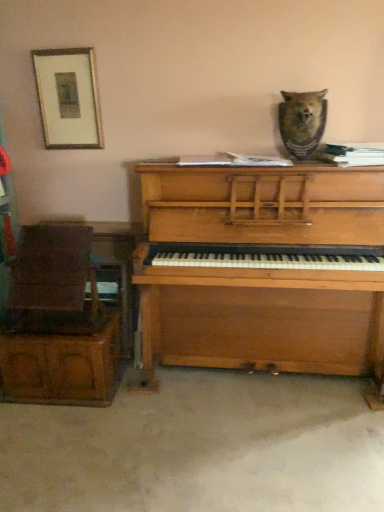
The height and width of the screenshot is (512, 384). Identify the location of wooden picture frame at upper left. (68, 98).

Image resolution: width=384 pixels, height=512 pixels. I want to click on wooden piano at center, so click(x=262, y=270).

The width and height of the screenshot is (384, 512). What do you see at coordinates (302, 122) in the screenshot? I see `brown fur bear at upper center` at bounding box center [302, 122].

This screenshot has height=512, width=384. Describe the element at coordinates (57, 323) in the screenshot. I see `wooden chair at left` at that location.

The height and width of the screenshot is (512, 384). What are the coordinates of `wooden picture frame at upper left` in the screenshot? It's located at (68, 98).

Image resolution: width=384 pixels, height=512 pixels. In the image, there is a wooden piano at center. In order to click on furniture below it (from the image's perspective) in this screenshot , I will do `click(57, 323)`.

Considering the relative positions of wooden chair at left and wooden piano at center in the image provided, is wooden chair at left behind wooden piano at center?

That is True.

Is wooden chair at left completely or partially outside of wooden piano at center?

wooden chair at left is positioned outside wooden piano at center.

Is wooden chair at left positioned with its back to wooden piano at center?

No, wooden chair at left is not facing away from wooden piano at center.

Who is bigger, wooden piano at center or wooden chair at left?

Bigger between the two is wooden piano at center.

Is wooden piano at center directly adjacent to wooden chair at left?

There is a gap between wooden piano at center and wooden chair at left.

From the image's perspective, would you say wooden piano at center is positioned over wooden chair at left?

Yes, from the image's perspective, wooden piano at center is on top of wooden chair at left.

Is wooden piano at center further to camera compared to wooden chair at left?

No, wooden piano at center is closer to the viewer.

Between point (41, 80) and point (309, 95), which one is positioned behind?

Point (41, 80)

Which is behind, wooden picture frame at upper left or brown fur bear at upper center?

wooden picture frame at upper left is more distant.

From the image's perspective, which one is positioned higher, wooden picture frame at upper left or brown fur bear at upper center?

wooden picture frame at upper left, from the image's perspective.

Could you tell me if wooden picture frame at upper left is turned towards brown fur bear at upper center?

No, wooden picture frame at upper left is not facing towards brown fur bear at upper center.

Is wooden chair at left smaller than wooden piano at center?

Yes.

Considering the relative sizes of wooden chair at left and wooden piano at center in the image provided, is wooden chair at left shorter than wooden piano at center?

Indeed, wooden chair at left has a lesser height compared to wooden piano at center.

Is wooden chair at left aimed at wooden piano at center?

No, wooden chair at left is not facing towards wooden piano at center.

From a real-world perspective, is wooden piano at center physically located above or below brown fur bear at upper center?

wooden piano at center is below brown fur bear at upper center.

In terms of width, does wooden piano at center look wider or thinner when compared to brown fur bear at upper center?

wooden piano at center is wider than brown fur bear at upper center.

Is wooden piano at center with brown fur bear at upper center?

wooden piano at center and brown fur bear at upper center are not in contact.

Is brown fur bear at upper center at the back of wooden piano at center?

No, wooden piano at center is not facing away from brown fur bear at upper center.

Would you say wooden chair at left is a long distance from wooden chair at left?

No.

Between point (97, 307) and point (115, 261), which one is positioned behind?

The point (115, 261) is behind.

From a real-world perspective, between wooden chair at left and wooden chair at left, who is vertically lower?

wooden chair at left is physically lower.

From the picture: Considering the sizes of objects wooden chair at left and wooden chair at left in the image provided, who is smaller, wooden chair at left or wooden chair at left?

wooden chair at left is smaller.

In terms of size, does brown fur bear at upper center appear bigger or smaller than wooden chair at left?

Considering their sizes, brown fur bear at upper center takes up less space than wooden chair at left.

Image resolution: width=384 pixels, height=512 pixels. In order to click on animal located above the wooden chair at left (from a real-world perspective) in this screenshot , I will do click(x=302, y=122).

Would you consider brown fur bear at upper center to be distant from wooden chair at left?

Yes, brown fur bear at upper center and wooden chair at left are quite far apart.

What's the angular difference between brown fur bear at upper center and wooden chair at left's facing directions?

The facing directions of brown fur bear at upper center and wooden chair at left are 4.94 degrees apart.

Locate an element on the screen. Image resolution: width=384 pixels, height=512 pixels. furniture above the wooden piano at center (from a real-world perspective) is located at coordinates (57, 323).

This screenshot has width=384, height=512. Identify the location of piano above the wooden chair at left (from the image's perspective). click(262, 270).

When comparing their distances from wooden piano at center, does wooden picture frame at upper left or brown fur bear at upper center seem closer?

brown fur bear at upper center is closer to wooden piano at center.

From the image, which object appears to be nearer to brown fur bear at upper center, wooden chair at left or wooden piano at center?

wooden piano at center is positioned closer to the anchor brown fur bear at upper center.

When comparing their distances from wooden chair at left, does wooden piano at center or brown fur bear at upper center seem closer?

Among the two, wooden piano at center is located nearer to wooden chair at left.

When comparing their distances from wooden chair at left, does wooden piano at center or brown fur bear at upper center seem closer?

Based on the image, wooden piano at center appears to be nearer to wooden chair at left.

Looking at the image, which one is located further to wooden piano at center, wooden chair at left or brown fur bear at upper center?

Based on the image, wooden chair at left appears to be further to wooden piano at center.

Considering their positions, is wooden piano at center positioned closer to wooden chair at left than wooden chair at left?

wooden chair at left is positioned closer to the anchor wooden chair at left.

Considering their positions, is brown fur bear at upper center positioned further to wooden picture frame at upper left than wooden piano at center?

Among the two, brown fur bear at upper center is located further to wooden picture frame at upper left.

Looking at the image, which one is located closer to wooden picture frame at upper left, wooden chair at left or brown fur bear at upper center?

The object closer to wooden picture frame at upper left is wooden chair at left.

At what (x,y) coordinates should I click in order to perform the action: click on table between wooden chair at left and wooden piano at center. Please return your answer as a coordinate pair (x, y). Looking at the image, I should click on (115, 268).

Locate an element on the screen. This screenshot has width=384, height=512. furniture between wooden picture frame at upper left and wooden chair at left from top to bottom is located at coordinates (57, 323).

You are a GUI agent. You are given a task and a screenshot of the screen. Output one action in this format:
    pyautogui.click(x=<x>, y=<y>)
    Task: Click on the table between wooden picture frame at upper left and brown fur bear at upper center in the horizontal direction
    This screenshot has height=512, width=384.
    Given the screenshot: What is the action you would take?
    pyautogui.click(x=115, y=268)

I want to click on picture frame between wooden chair at left and brown fur bear at upper center, so click(x=68, y=98).